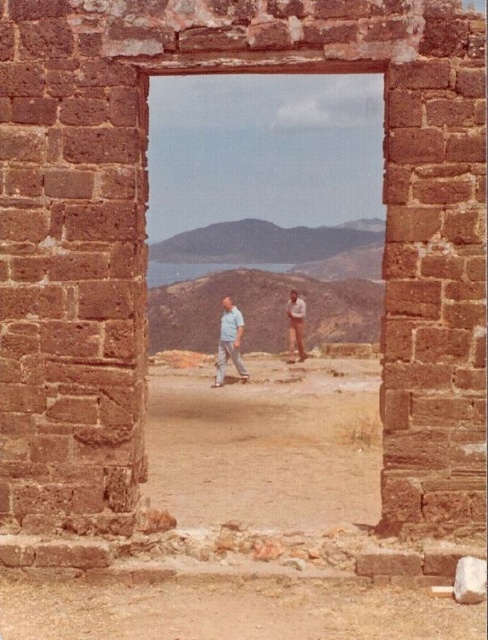
Question: Does brown sandy dirt at center appear over light brown leather pants at center?

Choices:
 (A) no
 (B) yes

Answer: (A)

Question: Is brown sandy dirt at center behind light blue denim pants at center?

Choices:
 (A) no
 (B) yes

Answer: (A)

Question: Which object appears farthest from the camera in this image?

Choices:
 (A) light blue denim pants at center
 (B) brown sandy dirt at center
 (C) light brown leather pants at center
 (D) transparent glass window at center

Answer: (C)

Question: Which point is farther to the camera?

Choices:
 (A) transparent glass window at center
 (B) brown sandy dirt at lower center
 (C) brown sandy dirt at center
 (D) light blue denim pants at center

Answer: (D)

Question: Which point is farther from the camera taking this photo?

Choices:
 (A) (214, 339)
 (B) (264, 476)

Answer: (A)

Question: From the image, what is the correct spatial relationship of brown sandy dirt at lower center in relation to light blue denim pants at center?

Choices:
 (A) right
 (B) left

Answer: (A)